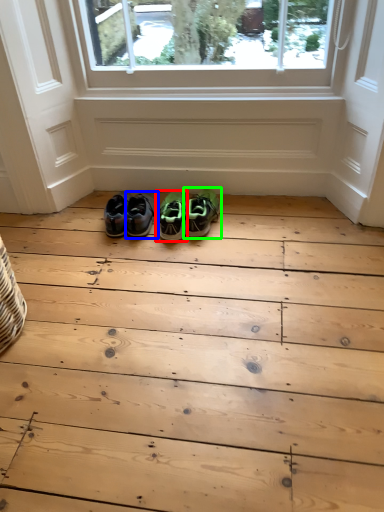
Question: Considering the real-world distances, which object is farthest from footwear (highlighted by a red box)? footwear (highlighted by a blue box) or footwear (highlighted by a green box)?

Choices:
 (A) footwear
 (B) footwear

Answer: (A)